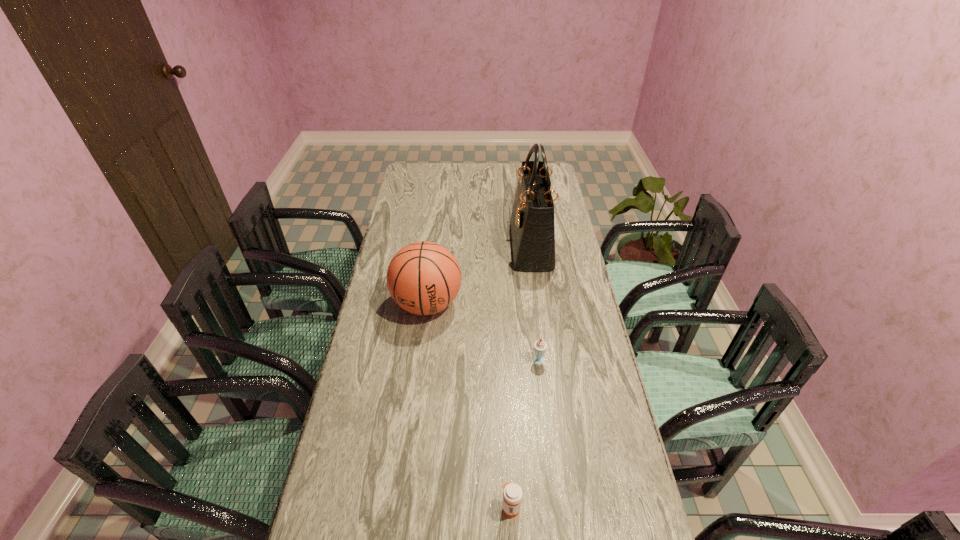
Locate an element on the screen. free spot between the tallest object and the second object from left to right is located at coordinates (521, 377).

Where is `free space that is in between the medicine and the third shortest object`? This screenshot has width=960, height=540. free space that is in between the medicine and the third shortest object is located at coordinates (469, 406).

At what (x,y) coordinates should I click in order to perform the action: click on free spot between the leftmost object and the handbag. Please return your answer as a coordinate pair (x, y). Image resolution: width=960 pixels, height=540 pixels. Looking at the image, I should click on (479, 275).

Locate an element on the screen. vacant space that's between the leftmost object and the third farthest object is located at coordinates (484, 332).

The width and height of the screenshot is (960, 540). In order to click on vacant space in between the handbag and the second farthest object in this screenshot , I will do `click(479, 275)`.

Locate an element on the screen. This screenshot has width=960, height=540. unoccupied position between the third nearest object and the third object from right to left is located at coordinates (469, 406).

The width and height of the screenshot is (960, 540). What are the coordinates of `vacant area between the handbag and the basketball` in the screenshot? It's located at (479, 275).

This screenshot has width=960, height=540. Find the location of `free spot between the shortest object and the farthest object`. free spot between the shortest object and the farthest object is located at coordinates (521, 377).

Choose which object is the third nearest neighbor to the basketball. Please provide its 2D coordinates. Your answer should be formatted as a tuple, i.e. [(x, y)], where the tuple contains the x and y coordinates of a point satisfying the conditions above.

[(512, 494)]

Locate an element on the screen. This screenshot has width=960, height=540. object that stands as the second closest to the third nearest object is located at coordinates (540, 346).